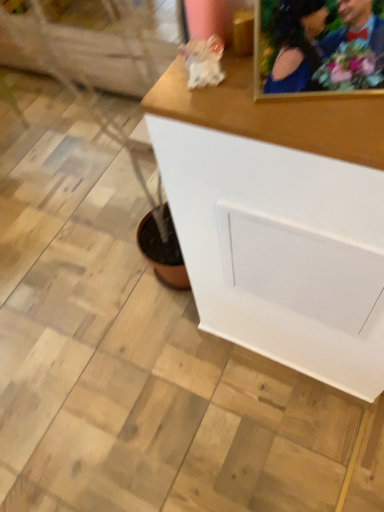
What do you see at coordinates (318, 46) in the screenshot? I see `gold-framed photo at upper right` at bounding box center [318, 46].

In order to click on gold-framed photo at upper right in this screenshot , I will do `click(318, 46)`.

Measure the distance between point (275, 93) and camera.

Point (275, 93) and camera are 22.13 inches apart.

This screenshot has height=512, width=384. What do you see at coordinates (277, 218) in the screenshot?
I see `white matte cabinet at center` at bounding box center [277, 218].

Locate an element on the screen. The image size is (384, 512). white matte cabinet at center is located at coordinates (277, 218).

Find the location of `gold-framed photo at upper right`. gold-framed photo at upper right is located at coordinates (318, 46).

Which object is positioned more to the left, white matte cabinet at center or gold-framed photo at upper right?

Positioned to the left is gold-framed photo at upper right.

In the image, is white matte cabinet at center positioned in front of or behind gold-framed photo at upper right?

Clearly, white matte cabinet at center is behind gold-framed photo at upper right.

Which is closer, (362, 356) or (374, 56)?

Point (362, 356) is farther from the camera than point (374, 56).

From the image's perspective, is white matte cabinet at center above or below gold-framed photo at upper right?

white matte cabinet at center is situated lower than gold-framed photo at upper right in the image.

From a real-world perspective, between white matte cabinet at center and gold-framed photo at upper right, who is vertically lower?

white matte cabinet at center, from a real-world perspective.

Is white matte cabinet at center wider or thinner than gold-framed photo at upper right?

Clearly, white matte cabinet at center has more width compared to gold-framed photo at upper right.

In terms of height, does white matte cabinet at center look taller or shorter compared to gold-framed photo at upper right?

In the image, white matte cabinet at center appears to be taller than gold-framed photo at upper right.

Which of these two, white matte cabinet at center or gold-framed photo at upper right, is bigger?

white matte cabinet at center.

Is white matte cabinet at center spatially inside gold-framed photo at upper right, or outside of it?

white matte cabinet at center is outside gold-framed photo at upper right.

Would you say white matte cabinet at center is a long distance from gold-framed photo at upper right?

That's not correct — white matte cabinet at center is a little close to gold-framed photo at upper right.

Is white matte cabinet at center oriented towards gold-framed photo at upper right?

No, white matte cabinet at center is not oriented towards gold-framed photo at upper right.

What's the angular difference between white matte cabinet at center and gold-framed photo at upper right's facing directions?

The angle between the facing direction of white matte cabinet at center and the facing direction of gold-framed photo at upper right is 19.8 degrees.

The width and height of the screenshot is (384, 512). Find the location of `table on the right of gold-framed photo at upper right`. table on the right of gold-framed photo at upper right is located at coordinates (277, 218).

Is gold-framed photo at upper right at the left side of white matte cabinet at center?

Yes, gold-framed photo at upper right is to the left of white matte cabinet at center.

From the picture: Is the depth of gold-framed photo at upper right greater than that of white matte cabinet at center?

No, it is in front of white matte cabinet at center.

Is point (303, 48) farther from viewer compared to point (279, 164)?

No.

From the image's perspective, is gold-framed photo at upper right above white matte cabinet at center?

Yes.

In the scene shown: From a real-world perspective, is gold-framed photo at upper right beneath white matte cabinet at center?

Incorrect, from a real-world perspective, gold-framed photo at upper right is higher than white matte cabinet at center.

Considering the sizes of gold-framed photo at upper right and white matte cabinet at center in the image, is gold-framed photo at upper right wider or thinner than white matte cabinet at center?

gold-framed photo at upper right is thinner than white matte cabinet at center.

Does gold-framed photo at upper right have a lesser height compared to white matte cabinet at center?

Indeed, gold-framed photo at upper right has a lesser height compared to white matte cabinet at center.

Who is smaller, gold-framed photo at upper right or white matte cabinet at center?

Smaller between the two is gold-framed photo at upper right.

Is gold-framed photo at upper right not within white matte cabinet at center?

Yes, gold-framed photo at upper right is outside of white matte cabinet at center.

Are gold-framed photo at upper right and white matte cabinet at center far apart?

gold-framed photo at upper right is actually quite close to white matte cabinet at center.

Consider the image. Is gold-framed photo at upper right facing away from white matte cabinet at center?

gold-framed photo at upper right is not turned away from white matte cabinet at center.

Can you tell me how much gold-framed photo at upper right and white matte cabinet at center differ in facing direction?

gold-framed photo at upper right and white matte cabinet at center are facing 19.8 degrees away from each other.

How far apart are gold-framed photo at upper right and white matte cabinet at center?

gold-framed photo at upper right is 10.05 inches from white matte cabinet at center.

You are a GUI agent. You are given a task and a screenshot of the screen. Output one action in this format:
    pyautogui.click(x=<x>, y=<y>)
    Task: Click on the table lying below the gold-framed photo at upper right (from the image's perspective)
    The image size is (384, 512).
    Given the screenshot: What is the action you would take?
    pyautogui.click(x=277, y=218)

Locate an element on the screen. The width and height of the screenshot is (384, 512). table below the gold-framed photo at upper right (from the image's perspective) is located at coordinates (277, 218).

At what (x,y) coordinates should I click in order to perform the action: click on table behind the gold-framed photo at upper right. Please return your answer as a coordinate pair (x, y). Looking at the image, I should click on (277, 218).